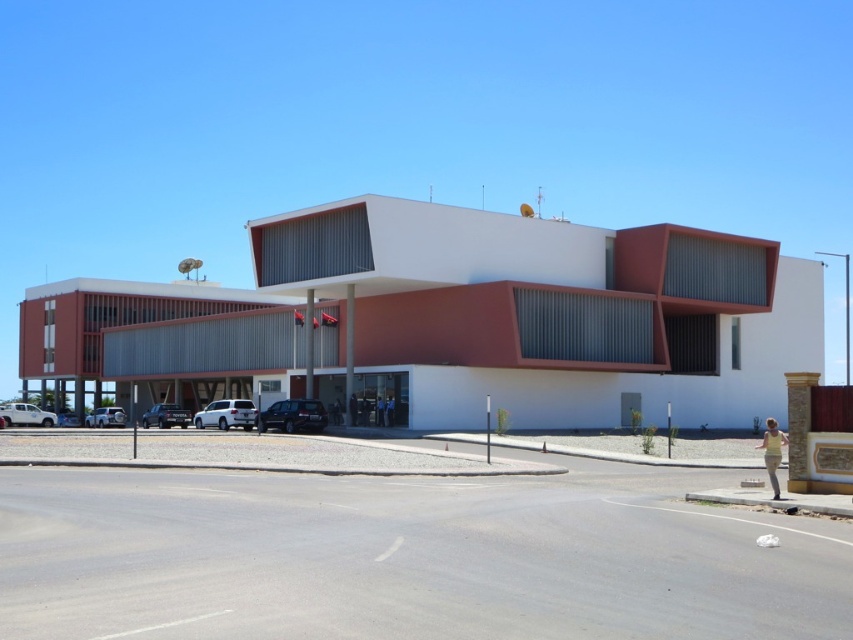
You are standing at the entrance of the modern building and want to park your car in the parking area. There is a satin silver suv at center. Based on its position coordinates, can you determine if there is space to park your car next to it?

The satin silver suv at center is located at coordinates point [225,413]. Without additional information about the parking area layout or available spaces, it is impossible to determine if there is space to park next to it.

Based on the photo, you are a delivery driver who needs to park your vehicle in the parking lot shown in the image. You see a satin black suv at center and a satin black car at lower left. Which vehicle is positioned closer to the entrance of the building?

The satin black suv at center is located above the satin black car at lower left, meaning it is closer to the entrance of the building since it is positioned higher up in the image.

You are a delivery driver who needs to park your 2.5 meter wide truck. You see the white matte truck at lower left and the satin black car at lower left in the parking area. Can your truck fit between them?

The distance between the white matte truck at lower left and the satin black car at lower left is 11.58 meters. Since your truck is only 2.5 meters wide, there is sufficient space to park between them.